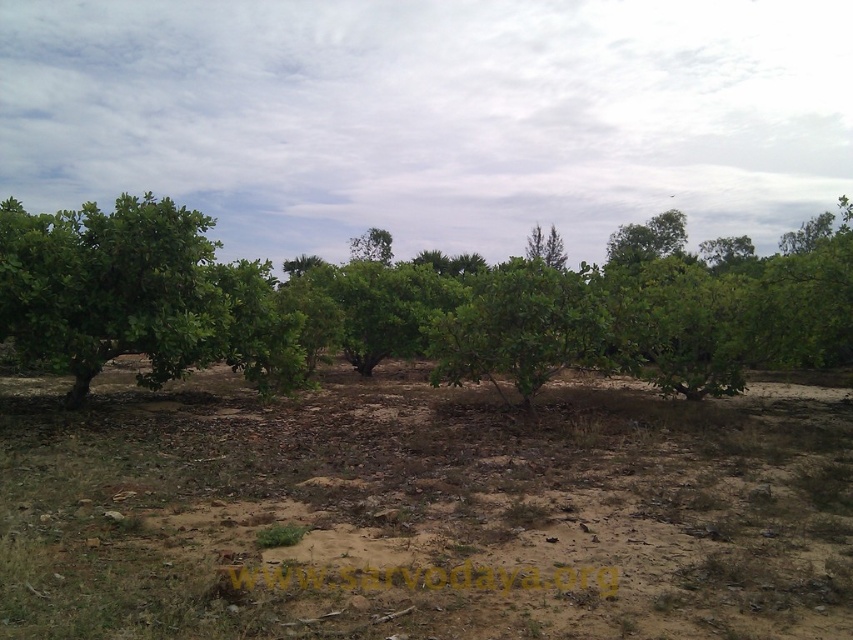
The image size is (853, 640). What do you see at coordinates (422, 509) in the screenshot?
I see `brown soil at center` at bounding box center [422, 509].

Does point (45, 609) come farther from viewer compared to point (15, 241)?

No, (45, 609) is closer to viewer.

Identify the location of brown soil at center. The width and height of the screenshot is (853, 640). (422, 509).

Which is above, brown soil at center or green leafy tree at center?

green leafy tree at center is above.

Who is positioned more to the right, brown soil at center or green leafy tree at center?

→ green leafy tree at center

Does point (598, 541) come farther from viewer compared to point (701, 376)?

No, it is in front of (701, 376).

Locate an element on the screen. brown soil at center is located at coordinates (422, 509).

Is green leafy tree at center below green leafy tree at upper right?

Indeed, green leafy tree at center is positioned under green leafy tree at upper right.

Is point (184, 218) positioned after point (624, 248)?

No.

Locate an element on the screen. green leafy tree at center is located at coordinates (399, 308).